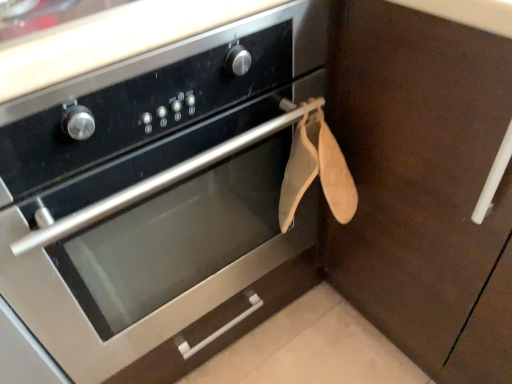
The height and width of the screenshot is (384, 512). What do you see at coordinates (160, 199) in the screenshot?
I see `satin black oven at center` at bounding box center [160, 199].

From the picture: Measure the distance between point (68, 278) and camera.

Point (68, 278) and camera are 25.71 inches apart.

Find the location of a particular element. satin black oven at center is located at coordinates (160, 199).

Find the location of a particular element. The width and height of the screenshot is (512, 384). brown matte cabinet at upper right is located at coordinates (423, 185).

The width and height of the screenshot is (512, 384). What do you see at coordinates (423, 185) in the screenshot? I see `brown matte cabinet at upper right` at bounding box center [423, 185].

The image size is (512, 384). In order to click on satin black oven at center in this screenshot , I will do `click(160, 199)`.

Considering the positions of objects brown matte cabinet at upper right and satin black oven at center in the image provided, who is more to the left, brown matte cabinet at upper right or satin black oven at center?

satin black oven at center.

Which object is more forward, brown matte cabinet at upper right or satin black oven at center?

satin black oven at center.

Is point (486, 299) farther from camera compared to point (166, 372)?

That is False.

From the image's perspective, does brown matte cabinet at upper right appear higher than satin black oven at center?

Yes.

From a real-world perspective, is brown matte cabinet at upper right physically located above or below satin black oven at center?

In terms of real-world spatial position, brown matte cabinet at upper right is below satin black oven at center.

Looking at their sizes, would you say brown matte cabinet at upper right is wider or thinner than satin black oven at center?

In the image, brown matte cabinet at upper right appears to be wider than satin black oven at center.

Considering the relative sizes of brown matte cabinet at upper right and satin black oven at center in the image provided, is brown matte cabinet at upper right shorter than satin black oven at center?

Correct, brown matte cabinet at upper right is not as tall as satin black oven at center.

Considering the relative sizes of brown matte cabinet at upper right and satin black oven at center in the image provided, is brown matte cabinet at upper right bigger than satin black oven at center?

Yes.

Would you say brown matte cabinet at upper right is outside satin black oven at center?

Yes, brown matte cabinet at upper right is outside of satin black oven at center.

Does brown matte cabinet at upper right touch satin black oven at center?

They are not placed beside each other.

Is brown matte cabinet at upper right oriented towards satin black oven at center?

Yes, brown matte cabinet at upper right is facing satin black oven at center.

Looking at this image, how different are the orientations of brown matte cabinet at upper right and satin black oven at center in degrees?

The angle between the facing direction of brown matte cabinet at upper right and the facing direction of satin black oven at center is 91.6 degrees.

Measure the distance between brown matte cabinet at upper right and satin black oven at center.

brown matte cabinet at upper right is 12.05 inches from satin black oven at center.

I want to click on oven above the brown matte cabinet at upper right (from a real-world perspective), so click(x=160, y=199).

Considering the relative positions of satin black oven at center and brown matte cabinet at upper right in the image provided, is satin black oven at center to the right of brown matte cabinet at upper right from the viewer's perspective?

No, satin black oven at center is not to the right of brown matte cabinet at upper right.

In the image, is satin black oven at center positioned in front of or behind brown matte cabinet at upper right?

Visually, satin black oven at center is located in front of brown matte cabinet at upper right.

Which is nearer, (252, 237) or (390, 138)?

Clearly, point (252, 237) is more distant from the camera than point (390, 138).

From the image's perspective, which one is positioned lower, satin black oven at center or brown matte cabinet at upper right?

From the image's view, satin black oven at center is below.

From a real-world perspective, who is located higher, satin black oven at center or brown matte cabinet at upper right?

In real-world perspective, satin black oven at center is above.

Between satin black oven at center and brown matte cabinet at upper right, which one has smaller width?

satin black oven at center.

Considering the sizes of objects satin black oven at center and brown matte cabinet at upper right in the image provided, who is taller, satin black oven at center or brown matte cabinet at upper right?

satin black oven at center.

Considering the sizes of satin black oven at center and brown matte cabinet at upper right in the image, is satin black oven at center bigger or smaller than brown matte cabinet at upper right?

Clearly, satin black oven at center is smaller in size than brown matte cabinet at upper right.

Does satin black oven at center contain brown matte cabinet at upper right?

Definitely not — brown matte cabinet at upper right is not inside satin black oven at center.

Is satin black oven at center far away from brown matte cabinet at upper right?

satin black oven at center is actually quite close to brown matte cabinet at upper right.

Is satin black oven at center positioned with its back to brown matte cabinet at upper right?

No.

This screenshot has width=512, height=384. What are the coordinates of `oven below the brown matte cabinet at upper right (from the image's perspective)` in the screenshot? It's located at (160, 199).

At what (x,y) coordinates should I click in order to perform the action: click on cabinetry that is behind the satin black oven at center. Please return your answer as a coordinate pair (x, y). Image resolution: width=512 pixels, height=384 pixels. Looking at the image, I should click on (423, 185).

Where is `oven that is on the left side of brown matte cabinet at upper right`? The height and width of the screenshot is (384, 512). oven that is on the left side of brown matte cabinet at upper right is located at coordinates 160,199.